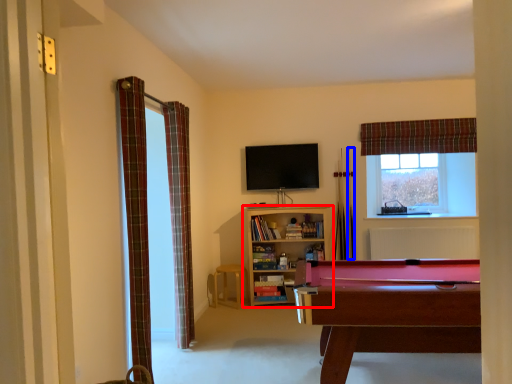
Question: Which object is closer to the camera taking this photo, bookcase (highlighted by a red box) or cue (highlighted by a blue box)?

Choices:
 (A) bookcase
 (B) cue

Answer: (A)